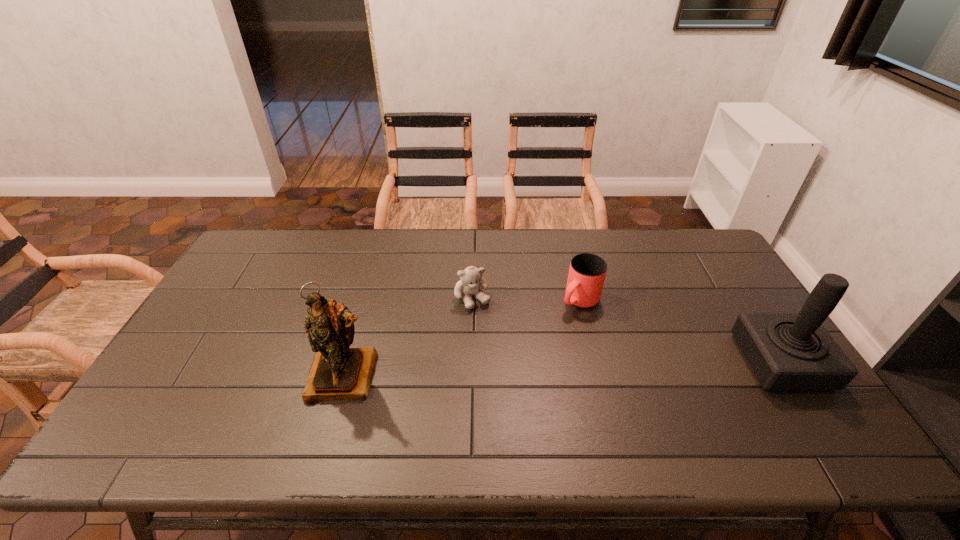
Identify the location of vacant space on the desktop that is between the figurine and the joystick and is positioned on the handle side of the second object from right to left. (502, 371).

At what (x,y) coordinates should I click in order to perform the action: click on vacant space on the desktop that is between the figurine and the joystick and is positioned on the face of the second object from left to right. Please return your answer as a coordinate pair (x, y). Looking at the image, I should click on (512, 370).